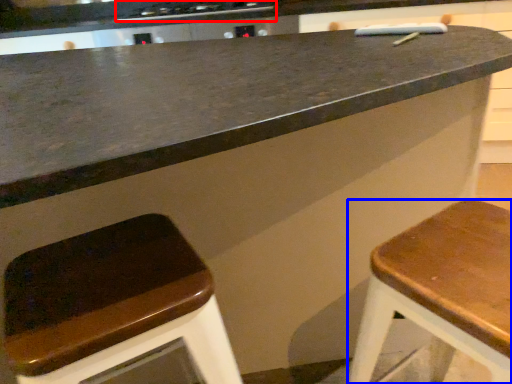
Question: Which object appears farthest to the camera in this image, stove (highlighted by a red box) or stool (highlighted by a blue box)?

Choices:
 (A) stove
 (B) stool

Answer: (A)